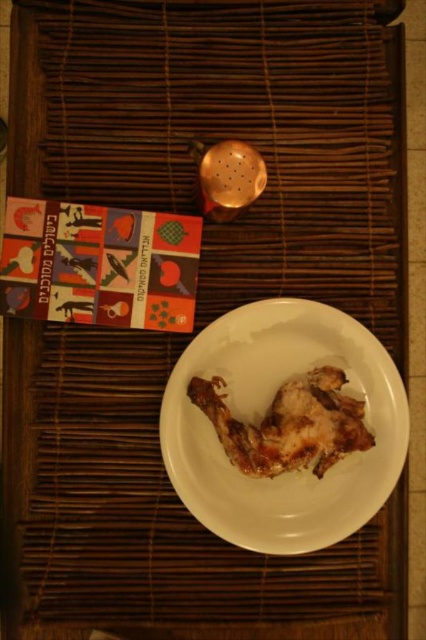
Question: Which object appears closest to the camera in this image?

Choices:
 (A) white glossy plate at center
 (B) golden crispy chicken at center

Answer: (A)

Question: Is white glossy plate at center positioned behind golden crispy chicken at center?

Choices:
 (A) yes
 (B) no

Answer: (B)

Question: Is white glossy plate at center thinner than golden crispy chicken at center?

Choices:
 (A) no
 (B) yes

Answer: (A)

Question: Where is white glossy plate at center located in relation to golden crispy chicken at center in the image?

Choices:
 (A) right
 (B) left

Answer: (A)